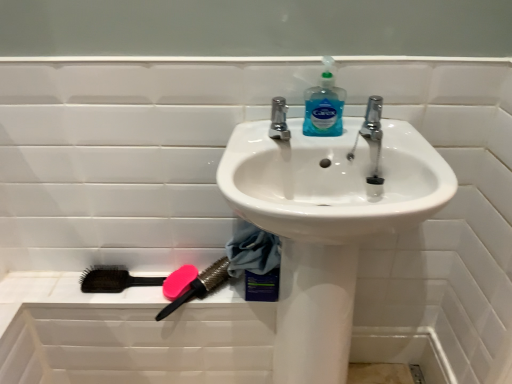
You are a GUI agent. You are given a task and a screenshot of the screen. Output one action in this format:
    pyautogui.click(x=<x>, y=<y>)
    Task: Click on the free region on the left part of black plastic brush at lower left, which is counted as the first brush, starting from the left
    Image resolution: width=512 pixels, height=384 pixels.
    Given the screenshot: What is the action you would take?
    pyautogui.click(x=55, y=281)